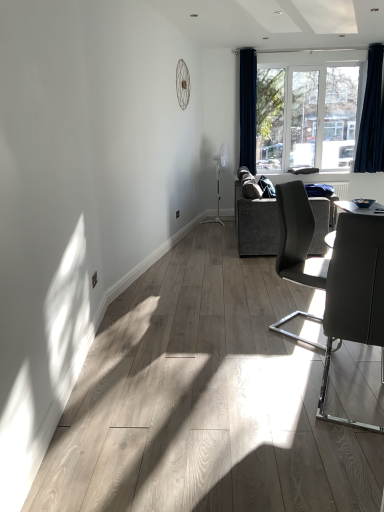
Question: In terms of size, does matte gray chair at right, the 1th chair in the front-to-back sequence, appear bigger or smaller than clear glass window at upper center?

Choices:
 (A) small
 (B) big

Answer: (B)

Question: Is point (370, 318) positioned closer to the camera than point (301, 61)?

Choices:
 (A) closer
 (B) farther

Answer: (A)

Question: Which object is the farthest from the dark gray fabric couch at center-right?

Choices:
 (A) clear glass window at upper center
 (B) navy blue velvet curtain at right, the 2th curtain positioned from the left
 (C) matte gray chair at center right, which appears as the second chair when viewed from the front
 (D) matte gray chair at right, the 1th chair in the front-to-back sequence
 (E) navy velvet curtain at upper center, which appears as the 1th curtain when viewed from the left

Answer: (D)

Question: Based on their relative distances, which object is farther from the matte gray chair at center right, which appears as the second chair when viewed from the front?

Choices:
 (A) clear glass window at upper center
 (B) matte gray chair at right, the second chair when ordered from back to front
 (C) dark gray fabric couch at center-right
 (D) navy velvet curtain at upper center, the second curtain viewed from the right
 (E) navy blue velvet curtain at right, the 2th curtain positioned from the left

Answer: (D)